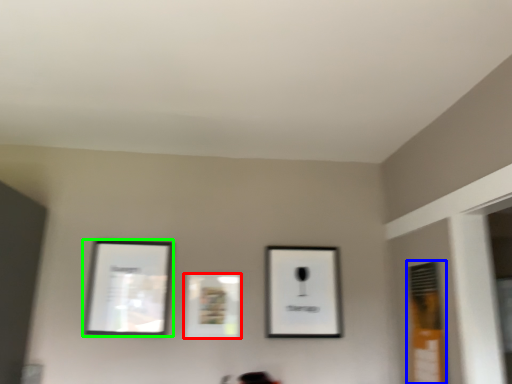
Question: Which object is positioned closest to picture frame (highlighted by a red box)? Select from window (highlighted by a blue box) and picture frame (highlighted by a green box).

Choices:
 (A) window
 (B) picture frame

Answer: (B)